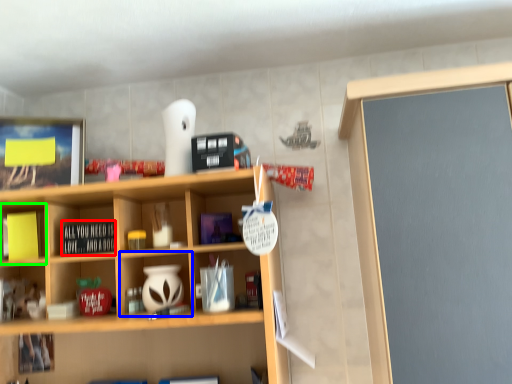
Question: Which is farther away from book (highlighted by a red box)? cabinet (highlighted by a blue box) or cabinet (highlighted by a green box)?

Choices:
 (A) cabinet
 (B) cabinet

Answer: (B)